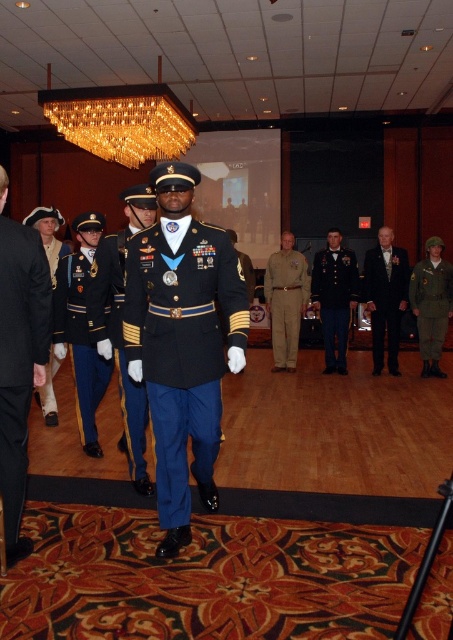
You are an event planner setting up a camera to capture the shiny blue fabric uniform at center during the ceremony. According to the coordinates provided, where should you position the camera to ensure the uniform is centered in the frame?

The shiny blue fabric uniform at center is located at coordinates point [119,346], so positioning the camera to center the frame at those coordinates will ensure the uniform is centered in the shot.

You are a photographer standing at the back of the room preparing to take a portrait of the shiny black fabric uniform at center. The camera requires the subject to be at least 10 feet away to avoid distortion. Is the current distance sufficient?

The shiny black fabric uniform at center is 8.09 feet away from the camera, which is less than the required 10 feet. To avoid distortion, the photographer should move back to increase the distance.